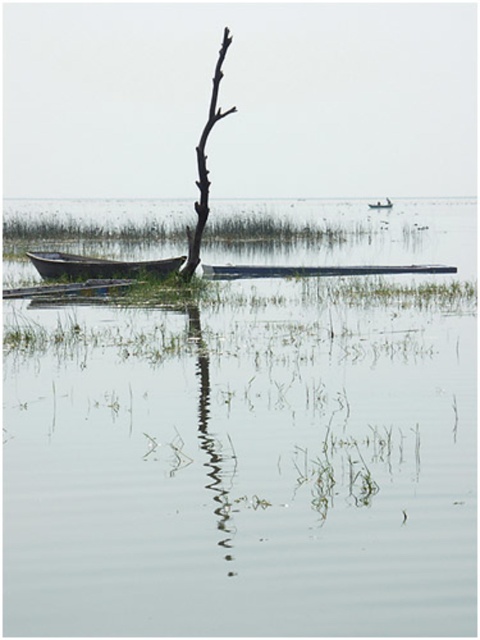
Does smooth brown tree trunk at center have a smaller size compared to wooden boat at center?

Correct, smooth brown tree trunk at center occupies less space than wooden boat at center.

Can you confirm if smooth brown tree trunk at center is positioned above wooden boat at center?

Incorrect, smooth brown tree trunk at center is not positioned above wooden boat at center.

Describe the element at coordinates (204, 164) in the screenshot. I see `smooth brown tree trunk at center` at that location.

The width and height of the screenshot is (480, 640). In order to click on smooth brown tree trunk at center in this screenshot , I will do `click(204, 164)`.

From the picture: Can you confirm if wooden canoe at left is wider than smooth brown tree trunk at center?

Correct, the width of wooden canoe at left exceeds that of smooth brown tree trunk at center.

Does wooden canoe at left appear on the left side of smooth brown tree trunk at center?

Yes, wooden canoe at left is to the left of smooth brown tree trunk at center.

In the scene shown: Who is more forward, (87, 275) or (202, 227)?

Point (202, 227) is in front.

Find the location of a particular element. This screenshot has height=640, width=480. wooden canoe at left is located at coordinates (98, 266).

Who is higher up, wooden canoe at left or smooth wood canoe at center?

smooth wood canoe at center is above.

Can you confirm if wooden canoe at left is positioned to the right of smooth wood canoe at center?

Incorrect, wooden canoe at left is not on the right side of smooth wood canoe at center.

Which is in front, point (87, 268) or point (229, 276)?

Positioned in front is point (87, 268).

Find the location of a particular element. Image resolution: width=480 pixels, height=640 pixels. wooden canoe at left is located at coordinates (98, 266).